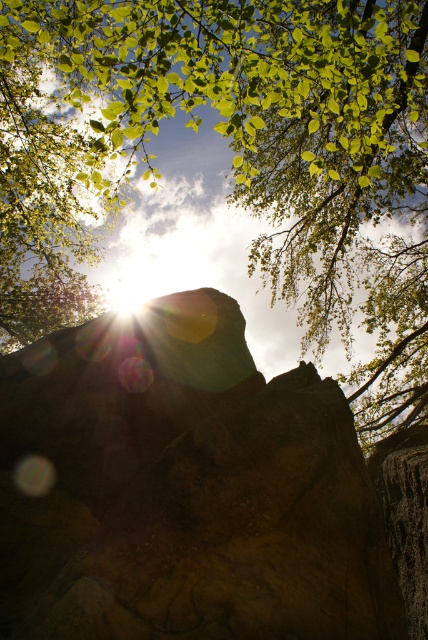
Does point (55, 445) lie behind point (165, 108)?

Yes, point (55, 445) is farther from viewer.

The image size is (428, 640). I want to click on brown rough rock at center, so click(184, 490).